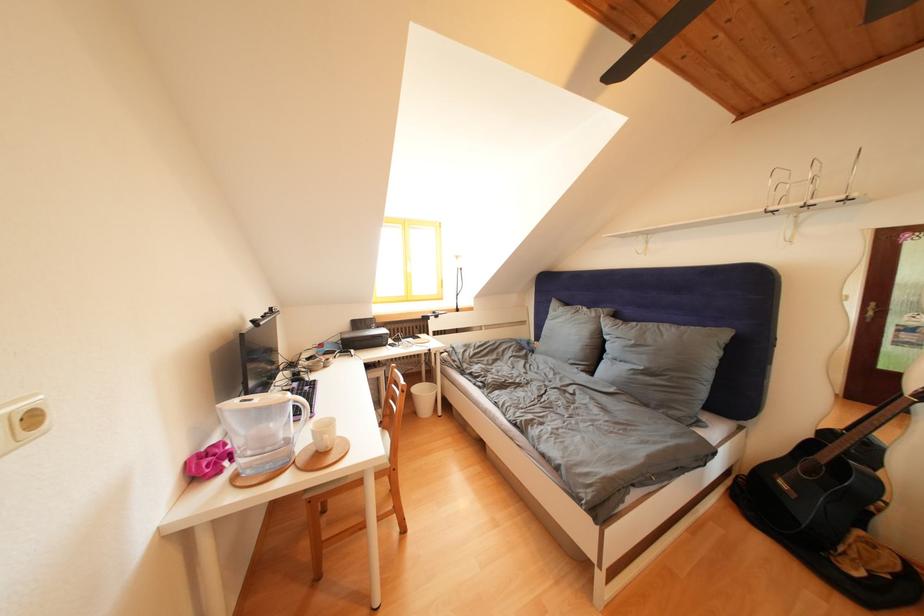
This screenshot has width=924, height=616. What do you see at coordinates (390, 466) in the screenshot?
I see `the chair sitting surface` at bounding box center [390, 466].